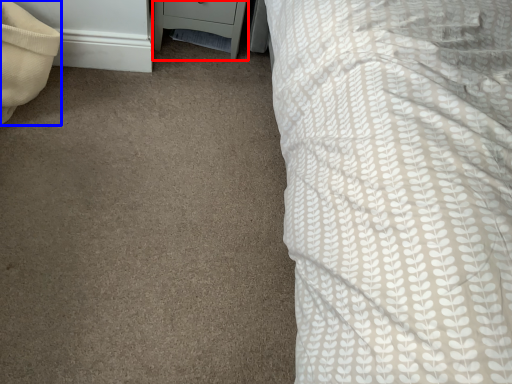
Question: Which object appears farthest to the camera in this image, nightstand (highlighted by a red box) or pillow (highlighted by a blue box)?

Choices:
 (A) nightstand
 (B) pillow

Answer: (A)